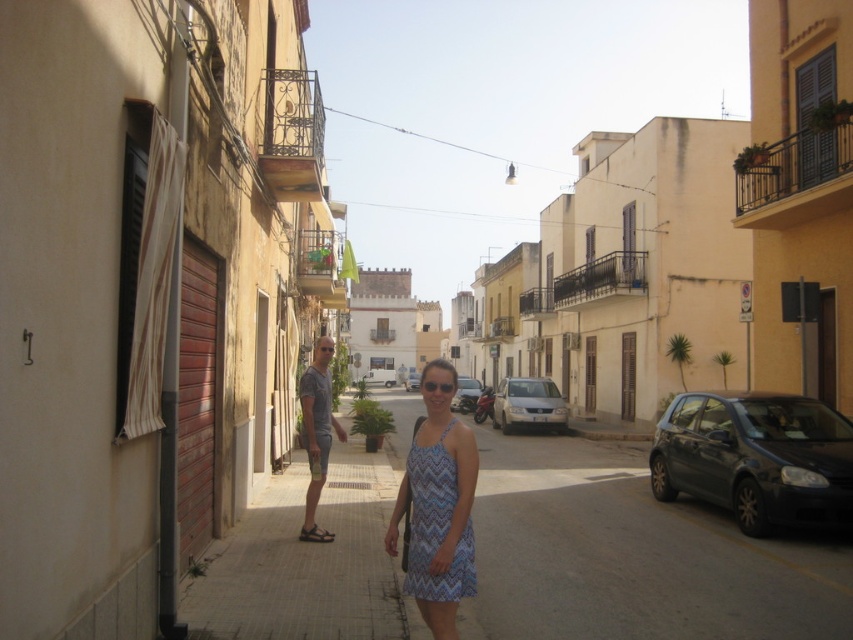
Is black metallic car at right shorter than silver metallic sedan at center?

Yes, black metallic car at right is shorter than silver metallic sedan at center.

Does point (764, 492) come farther from viewer compared to point (535, 412)?

No, it is in front of (535, 412).

Identify the location of black metallic car at right. The image size is (853, 640). (756, 458).

Can you confirm if smooth concrete pavement at center is positioned to the right of brown leather sandal at lower center?

Indeed, smooth concrete pavement at center is positioned on the right side of brown leather sandal at lower center.

Which is more to the left, smooth concrete pavement at center or brown leather sandal at lower center?

brown leather sandal at lower center is more to the left.

Is point (364, 454) positioned behind point (300, 536)?

Yes, it is behind point (300, 536).

Where is `smooth concrete pavement at center`? smooth concrete pavement at center is located at coordinates (631, 556).

Does metallic silver scooter at center appear under brown leather sandal at lower center?

Incorrect, metallic silver scooter at center is not positioned below brown leather sandal at lower center.

This screenshot has height=640, width=853. In order to click on metallic silver scooter at center in this screenshot , I will do pos(466,394).